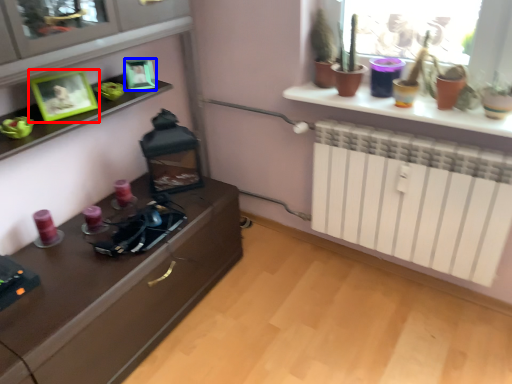
Question: Which point is closer to the camera, picture frame (highlighted by a red box) or picture frame (highlighted by a blue box)?

Choices:
 (A) picture frame
 (B) picture frame

Answer: (A)